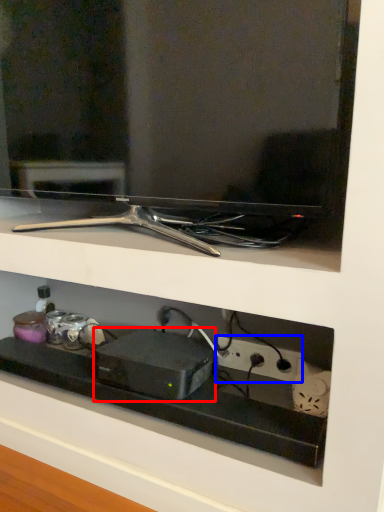
Question: Which object appears closest to the camera in this image, appliance (highlighted by a red box) or electric outlet (highlighted by a blue box)?

Choices:
 (A) appliance
 (B) electric outlet

Answer: (A)